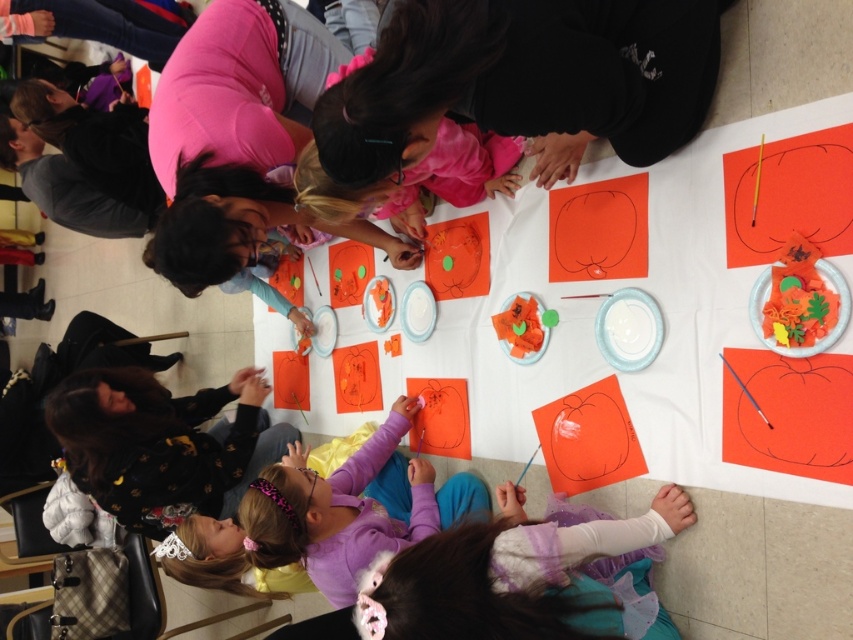
You are a teacher observing the craft activity. You need to retrieve the orange paper plate at upper right for a demonstration. Which plate should you move first if you want to access it without disturbing the white paper plate at center?

The orange paper plate at upper right is in front of the white paper plate at center, so you can access it directly without moving the white paper plate at center first.

You are a teacher organizing a craft activity for children. You have a white glossy paper plate at center and an orange paper plate at upper right on the table. The children need to place their decorations between these two plates. What is the minimum distance the children should maintain between the decorations to ensure they are placed between the two plates?

The children should maintain a minimum distance of 28.28 centimeters between the decorations to ensure they are placed between the white glossy paper plate at center and the orange paper plate at upper right.